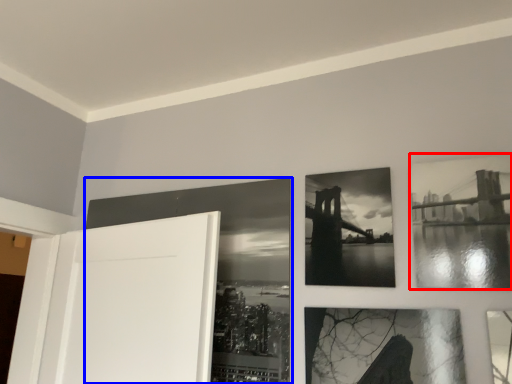
Question: Which of the following is the closest to the observer, picture frame (highlighted by a red box) or picture frame (highlighted by a blue box)?

Choices:
 (A) picture frame
 (B) picture frame

Answer: (A)